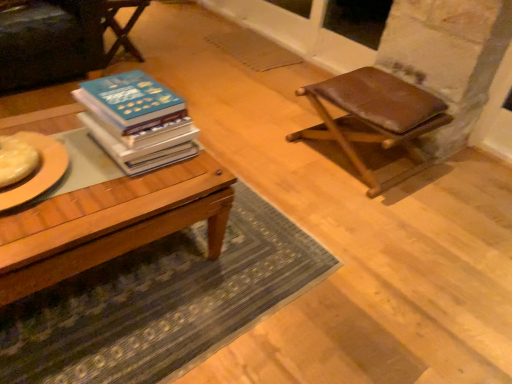
Question: Would you say wooden chair at upper left contains hardcover books at center?

Choices:
 (A) yes
 (B) no

Answer: (B)

Question: Can you confirm if wooden chair at upper left is taller than hardcover books at center?

Choices:
 (A) yes
 (B) no

Answer: (A)

Question: Considering the relative sizes of wooden chair at upper left and hardcover books at center in the image provided, is wooden chair at upper left shorter than hardcover books at center?

Choices:
 (A) yes
 (B) no

Answer: (B)

Question: Is wooden chair at upper left positioned with its back to hardcover books at center?

Choices:
 (A) no
 (B) yes

Answer: (A)

Question: Can we say wooden chair at upper left lies outside hardcover books at center?

Choices:
 (A) yes
 (B) no

Answer: (A)

Question: From a real-world perspective, is wooden chair at upper left physically above hardcover books at center?

Choices:
 (A) yes
 (B) no

Answer: (B)

Question: Does wooden table at center have a smaller size compared to wooden chair at upper left?

Choices:
 (A) yes
 (B) no

Answer: (B)

Question: From a real-world perspective, is wooden table at center physically below wooden chair at upper left?

Choices:
 (A) no
 (B) yes

Answer: (B)

Question: From the image's perspective, is wooden table at center over wooden chair at upper left?

Choices:
 (A) no
 (B) yes

Answer: (A)

Question: Is wooden table at center to the left of wooden chair at upper left from the viewer's perspective?

Choices:
 (A) no
 (B) yes

Answer: (A)

Question: Is wooden table at center wider than wooden chair at upper left?

Choices:
 (A) yes
 (B) no

Answer: (A)

Question: Does wooden table at center touch wooden chair at upper left?

Choices:
 (A) no
 (B) yes

Answer: (A)

Question: Can you confirm if wooden chair at upper left is shorter than wooden table at center?

Choices:
 (A) no
 (B) yes

Answer: (A)